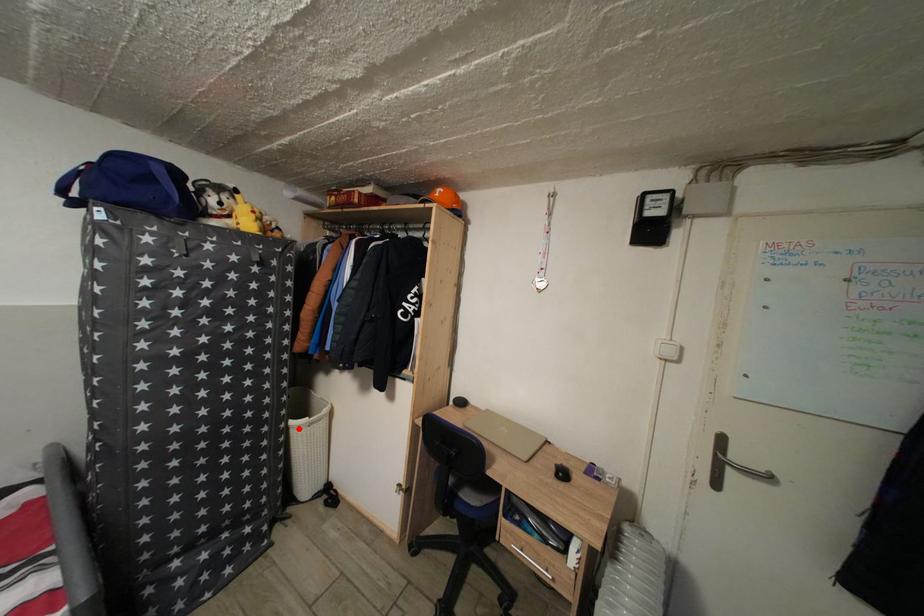
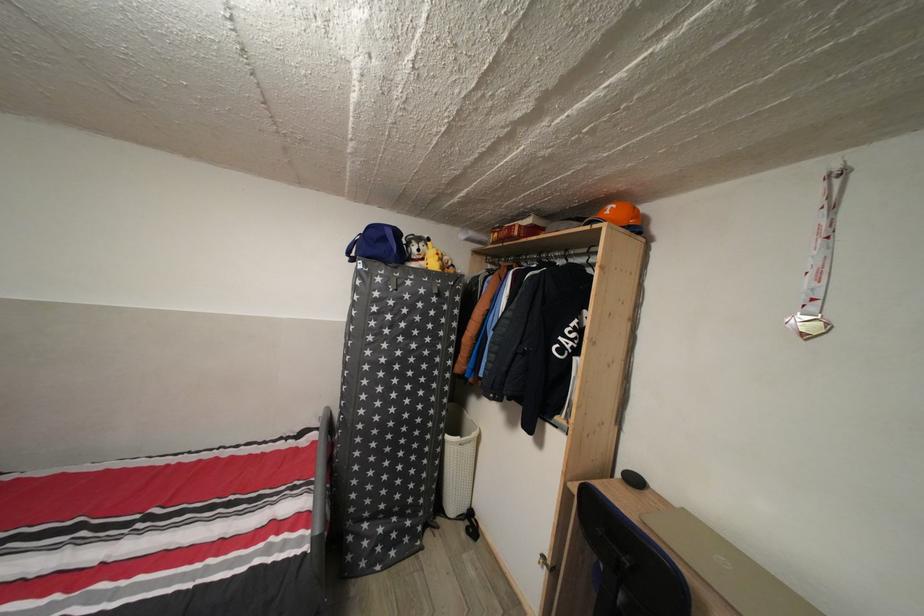
The point at the highlighted location is marked in the first image. Where is the corresponding point in the second image?

(455, 444)